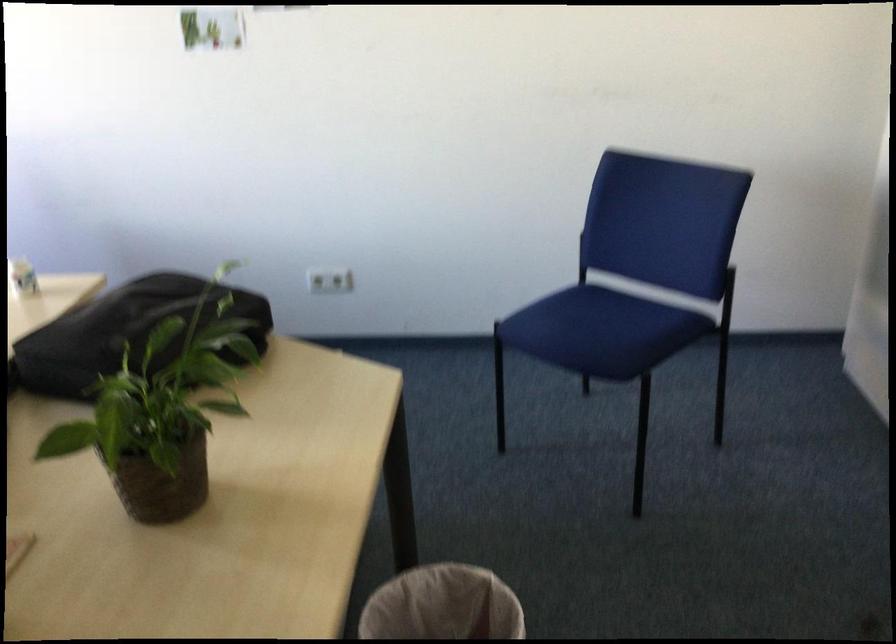
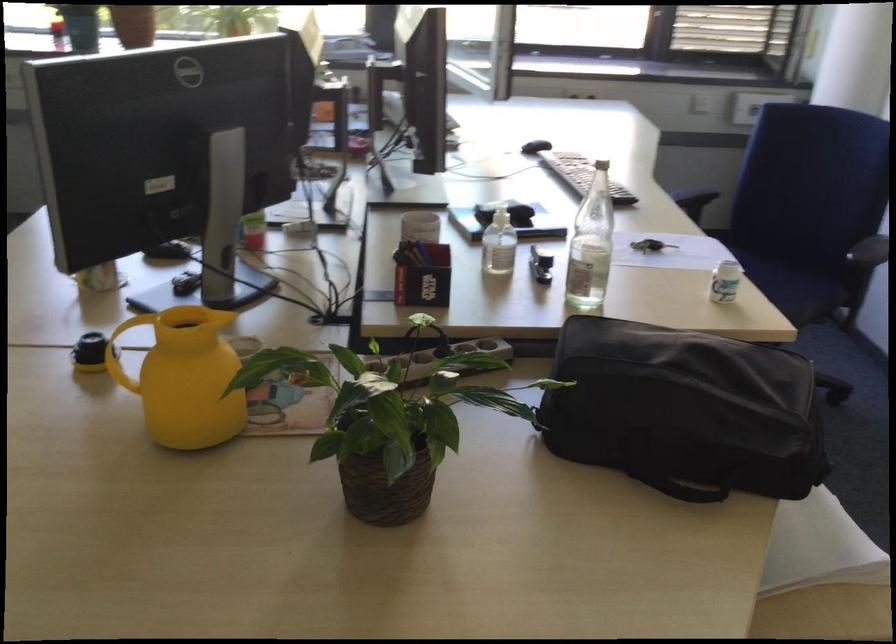
In the second image, find the point that corresponds to point (170, 466) in the first image.

(383, 484)